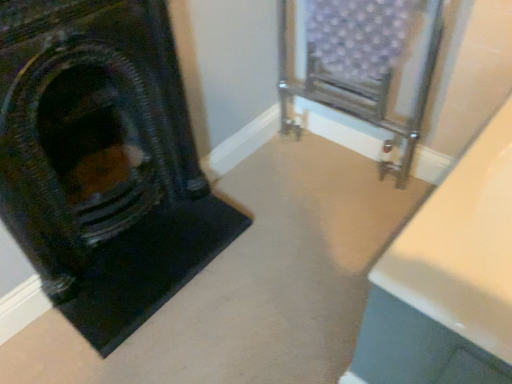
Find the location of a particular element. The height and width of the screenshot is (384, 512). free point to the right of matte black fireplace at left is located at coordinates (267, 247).